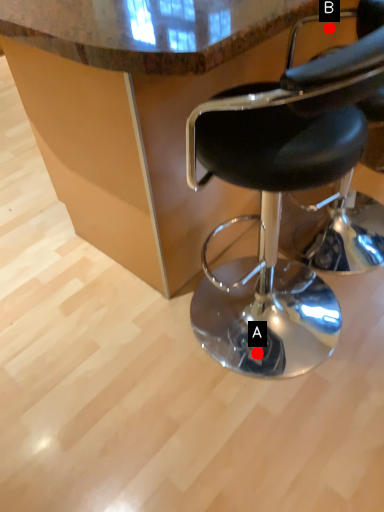
Question: Two points are circled on the image, labeled by A and B beside each circle. Among these points, which one is nearest to the camera?

Choices:
 (A) A is closer
 (B) B is closer

Answer: (A)